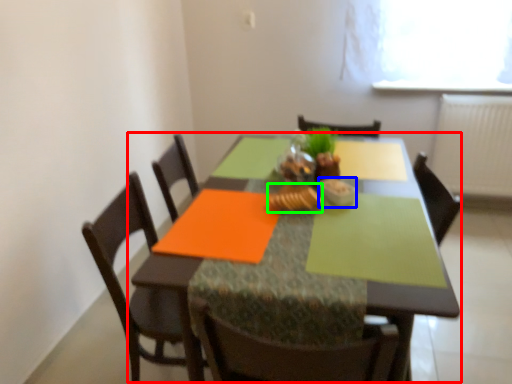
Question: Considering the real-world distances, which object is closest to kitchen & dining room table (highlighted by a red box)? tableware (highlighted by a blue box) or food (highlighted by a green box).

Choices:
 (A) tableware
 (B) food

Answer: (B)